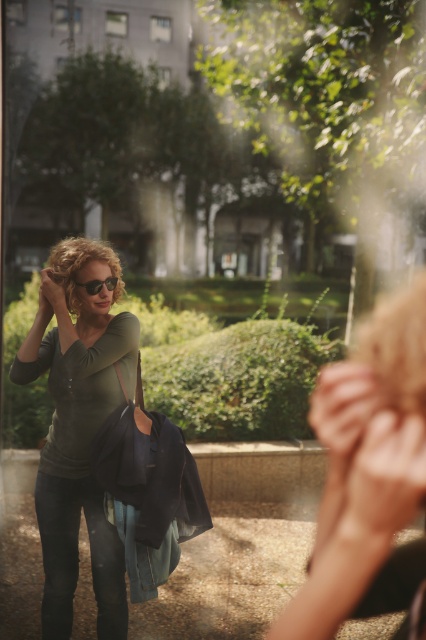
You are a photographer positioned at the entrance of the garden. You want to take a photo that includes both the smooth beige handbag at lower right and the matte green shirt at center. Which object should you focus on first to ensure both are in sharp focus?

You should focus on the smooth beige handbag at lower right first because it is closer to the viewer than the matte green shirt at center. By focusing on the closer object, the background object will still be in focus due to the depth of field.

You are a photographer standing at the edge of the paved area in the foreground. You want to capture a photo that includes both the smooth beige handbag at lower right and the matte green shirt at center. What is the minimum distance you need to move backward to ensure both objects are fully visible in your frame?

The smooth beige handbag at lower right and the matte green shirt at center are 5.45 feet apart. To include both in your photo, you need to move backward at least 5.45 feet to ensure the entire distance between them fits within the frame.

You are a photographer aiming to capture a portrait of the woman in the scene. You want to ensure that both the matte green shirt at center and the matte black sunglasses at center are clearly visible in the frame. Based on their positions, which object should you focus on first to ensure both are in focus?

The matte green shirt at center is located below the matte black sunglasses at center. To ensure both are in focus, you should focus on the matte black sunglasses at center first since it is closer to the camera, and the shirt below it will naturally fall into the depth of field.